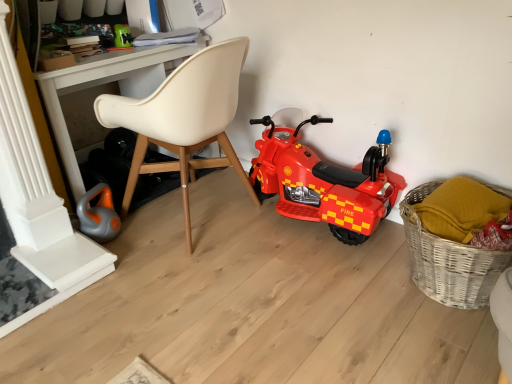
Question: From a real-world perspective, is red plastic toy motorcycle at center on white plastic desk at upper center?

Choices:
 (A) yes
 (B) no

Answer: (B)

Question: Is red plastic toy motorcycle at center oriented towards white plastic desk at upper center?

Choices:
 (A) yes
 (B) no

Answer: (B)

Question: Can you confirm if red plastic toy motorcycle at center is wider than white plastic desk at upper center?

Choices:
 (A) no
 (B) yes

Answer: (A)

Question: Considering the relative sizes of red plastic toy motorcycle at center and white plastic desk at upper center in the image provided, is red plastic toy motorcycle at center taller than white plastic desk at upper center?

Choices:
 (A) yes
 (B) no

Answer: (B)

Question: From a real-world perspective, is red plastic toy motorcycle at center located beneath white plastic desk at upper center?

Choices:
 (A) no
 (B) yes

Answer: (B)

Question: Is beige leather chair at center inside the boundaries of woven wicker basket at lower right, or outside?

Choices:
 (A) inside
 (B) outside

Answer: (B)

Question: Is point (214, 104) closer or farther from the camera than point (509, 254)?

Choices:
 (A) farther
 (B) closer

Answer: (A)

Question: In the image, is beige leather chair at center on the left side or the right side of woven wicker basket at lower right?

Choices:
 (A) right
 (B) left

Answer: (B)

Question: From a real-world perspective, is beige leather chair at center positioned above or below woven wicker basket at lower right?

Choices:
 (A) below
 (B) above

Answer: (B)

Question: Is red plastic toy motorcycle at center in front of or behind beige leather chair at center in the image?

Choices:
 (A) behind
 (B) front

Answer: (A)

Question: Is point (346, 235) closer or farther from the camera than point (232, 112)?

Choices:
 (A) closer
 (B) farther

Answer: (A)

Question: In terms of size, does red plastic toy motorcycle at center appear bigger or smaller than beige leather chair at center?

Choices:
 (A) big
 (B) small

Answer: (B)

Question: From their relative heights in the image, would you say red plastic toy motorcycle at center is taller or shorter than beige leather chair at center?

Choices:
 (A) short
 (B) tall

Answer: (A)

Question: Based on their sizes in the image, would you say orange rubber toy at lower left, the first toy when ordered from front to back, is bigger or smaller than green plastic toy at upper left, arranged as the first toy when viewed from the back?

Choices:
 (A) big
 (B) small

Answer: (A)

Question: Is orange rubber toy at lower left, which is the 1th toy in bottom-to-top order, to the left or to the right of green plastic toy at upper left, which ranks as the second toy in front-to-back order, in the image?

Choices:
 (A) right
 (B) left

Answer: (B)